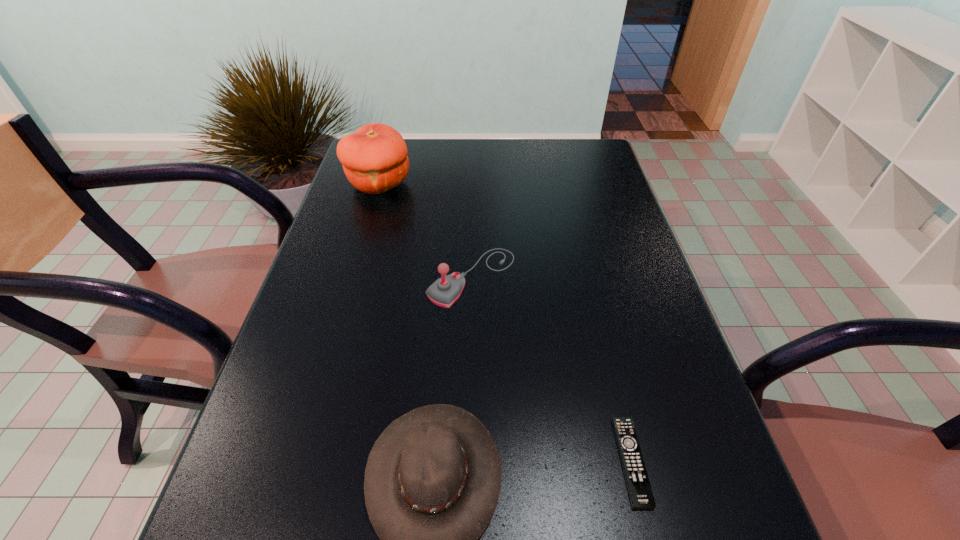
I want to click on pumpkin, so click(x=374, y=158).

The height and width of the screenshot is (540, 960). What are the coordinates of `the leftmost object` in the screenshot? It's located at (374, 158).

Identify the location of joystick. (446, 290).

I want to click on the shortest object, so click(x=640, y=493).

Locate an element on the screen. This screenshot has width=960, height=540. the rightmost object is located at coordinates (640, 493).

What are the coordinates of `vacant space positioned 0.150m on the right of the farthest object` in the screenshot? It's located at (463, 184).

Find the location of a particular element. Image resolution: width=960 pixels, height=540 pixels. vacant space located 0.080m on the front of the joystick is located at coordinates (470, 339).

Find the location of a particular element. free region located 0.290m on the left of the shortest object is located at coordinates (445, 462).

The image size is (960, 540). I want to click on object at the far edge, so click(374, 158).

Locate an element on the screen. Image resolution: width=960 pixels, height=540 pixels. object that is at the left edge is located at coordinates click(x=374, y=158).